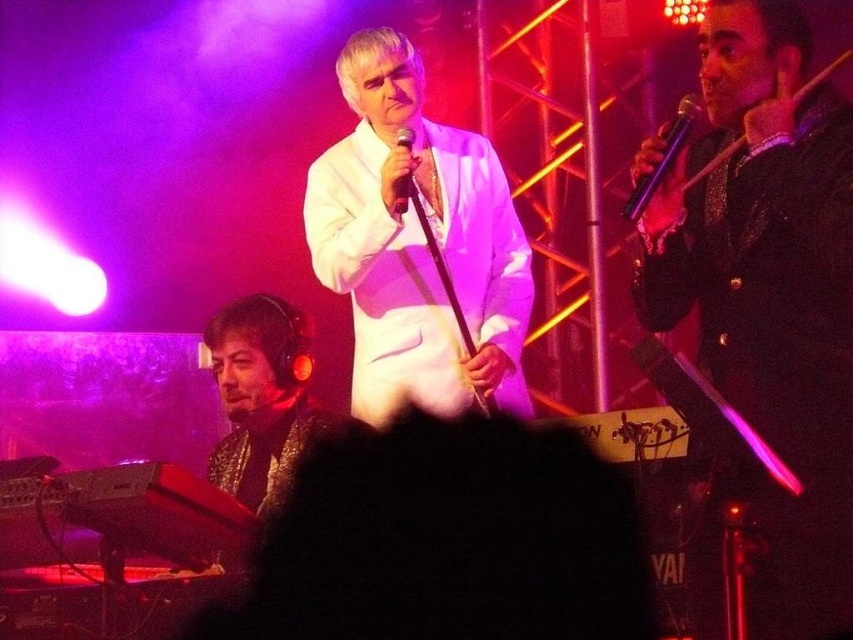
In the scene shown: How far apart are shiny black jacket at center and black matte microphone at center?

shiny black jacket at center is 3.53 feet from black matte microphone at center.

Consider the image. Is shiny black jacket at center positioned in front of black matte microphone at center?

That is True.

Describe the element at coordinates (769, 289) in the screenshot. I see `shiny black jacket at center` at that location.

This screenshot has height=640, width=853. I want to click on shiny black jacket at center, so click(769, 289).

Does shiny black jacket at center have a lesser width compared to purple metallic microphone at upper right?

In fact, shiny black jacket at center might be wider than purple metallic microphone at upper right.

Can you confirm if shiny black jacket at center is positioned to the left of purple metallic microphone at upper right?

No, shiny black jacket at center is not to the left of purple metallic microphone at upper right.

What do you see at coordinates (769, 289) in the screenshot? I see `shiny black jacket at center` at bounding box center [769, 289].

Identify the location of shiny black jacket at center. The width and height of the screenshot is (853, 640). (769, 289).

Who is more distant from viewer, (519,289) or (674,147)?

Point (519,289)

Locate an element on the screen. white satin suit at center is located at coordinates (416, 244).

Is point (389, 205) in front of point (625, 216)?

No, (389, 205) is further to viewer.

Where is `white satin suit at center`? Image resolution: width=853 pixels, height=640 pixels. white satin suit at center is located at coordinates (416, 244).